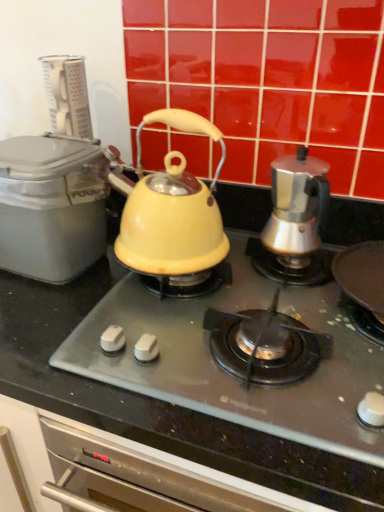
Question: From a real-world perspective, is satin silver coffee maker at right, which is the first kettle in right-to-left order, under matte yellow kettle at center?

Choices:
 (A) no
 (B) yes

Answer: (A)

Question: Is satin silver coffee maker at right, which is the first kettle in right-to-left order, to the left of matte yellow kettle at center from the viewer's perspective?

Choices:
 (A) yes
 (B) no

Answer: (B)

Question: Is satin silver coffee maker at right, which is the 2th kettle from left to right, directly adjacent to matte yellow kettle at center?

Choices:
 (A) yes
 (B) no

Answer: (B)

Question: Is matte yellow kettle at center inside satin silver coffee maker at right, which is the 2th kettle from left to right?

Choices:
 (A) yes
 (B) no

Answer: (B)

Question: Is matte yellow kettle at center at the back of satin silver coffee maker at right, which is the first kettle in right-to-left order?

Choices:
 (A) yes
 (B) no

Answer: (B)

Question: In terms of height, does matte gray container at left look taller or shorter compared to matte yellow kettle at center, the 2th kettle positioned from the right?

Choices:
 (A) tall
 (B) short

Answer: (B)

Question: Is matte gray container at left wider or thinner than matte yellow kettle at center, the 2th kettle positioned from the right?

Choices:
 (A) thin
 (B) wide

Answer: (B)

Question: From a real-world perspective, relative to matte yellow kettle at center, acting as the first kettle starting from the left, is matte gray container at left vertically above or below?

Choices:
 (A) above
 (B) below

Answer: (B)

Question: Is matte gray container at left to the left or to the right of matte yellow kettle at center, the 2th kettle positioned from the right, in the image?

Choices:
 (A) right
 (B) left

Answer: (B)

Question: Considering the positions of point (279, 242) and point (59, 143), is point (279, 242) closer or farther from the camera than point (59, 143)?

Choices:
 (A) closer
 (B) farther

Answer: (B)

Question: Is satin silver coffee maker at right, which is the 2th kettle from left to right, in front of or behind matte gray container at left in the image?

Choices:
 (A) behind
 (B) front

Answer: (A)

Question: Is satin silver coffee maker at right, which is the first kettle in right-to-left order, wider or thinner than matte gray container at left?

Choices:
 (A) wide
 (B) thin

Answer: (B)

Question: From a real-world perspective, is satin silver coffee maker at right, which is the 2th kettle from left to right, positioned above or below matte gray container at left?

Choices:
 (A) above
 (B) below

Answer: (A)

Question: Considering the positions of point (39, 262) and point (160, 340), is point (39, 262) closer or farther from the camera than point (160, 340)?

Choices:
 (A) closer
 (B) farther

Answer: (B)

Question: Relative to matte yellow kettle at center, is matte gray container at left in front or behind?

Choices:
 (A) front
 (B) behind

Answer: (B)